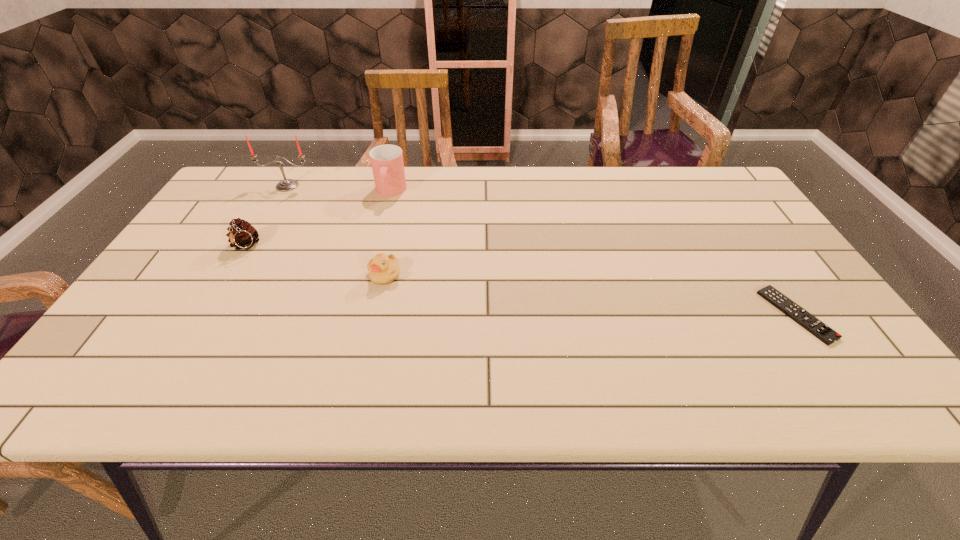
Where is `the tallest object`? the tallest object is located at coordinates (285, 185).

This screenshot has width=960, height=540. I want to click on the fourth shortest object, so click(x=387, y=163).

The image size is (960, 540). I want to click on the third nearest object, so click(x=241, y=234).

The width and height of the screenshot is (960, 540). Find the location of `pinecone`. pinecone is located at coordinates (241, 234).

Image resolution: width=960 pixels, height=540 pixels. Find the location of `the second nearest object`. the second nearest object is located at coordinates (383, 269).

Identify the location of the second shortest object. (383, 269).

Locate an element on the screen. The height and width of the screenshot is (540, 960). the rightmost object is located at coordinates (820, 330).

At what (x,y) coordinates should I click in order to perform the action: click on the nearest object. Please return your answer as a coordinate pair (x, y). Looking at the image, I should click on (820, 330).

This screenshot has width=960, height=540. I want to click on vacant space situated on the front-facing side of the tallest object, so click(x=238, y=272).

This screenshot has height=540, width=960. I want to click on free space located on the side of the fourth shortest object with the handle, so click(370, 269).